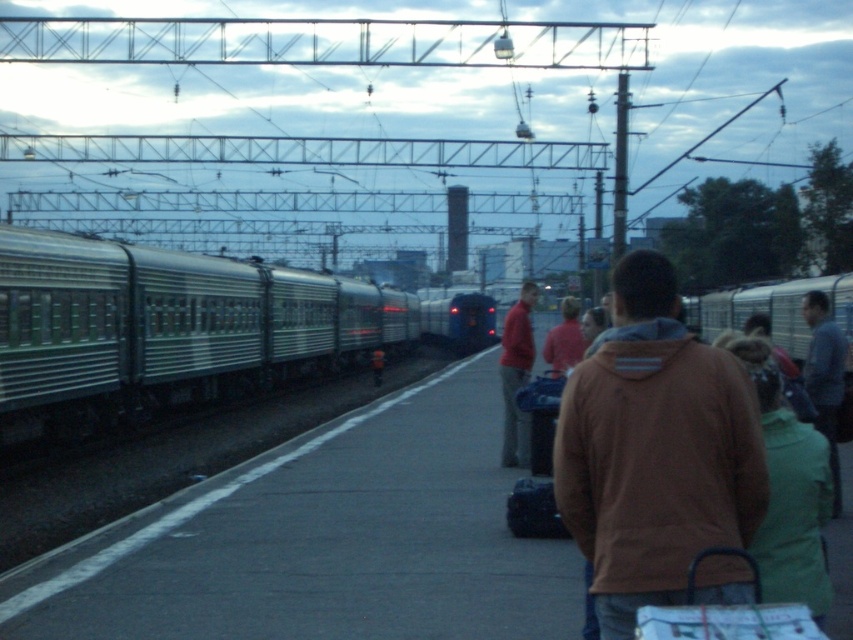
Question: Which of the following is the farthest from the observer?

Choices:
 (A) brown hoodie at center
 (B) green metallic train at left

Answer: (B)

Question: Can you confirm if green metallic train at left is thinner than dark gray metallic train at center?

Choices:
 (A) no
 (B) yes

Answer: (A)

Question: Does brown hoodie at center come behind dark gray metallic train at center?

Choices:
 (A) no
 (B) yes

Answer: (A)

Question: Among these objects, which one is nearest to the camera?

Choices:
 (A) green metallic train at left
 (B) brown hoodie at center
 (C) dark gray metallic train at center

Answer: (B)

Question: Among these objects, which one is farthest from the camera?

Choices:
 (A) green metallic train at left
 (B) dark gray metallic train at center
 (C) brown hoodie at center

Answer: (B)

Question: Is green metallic train at left smaller than brown hoodie at center?

Choices:
 (A) yes
 (B) no

Answer: (B)